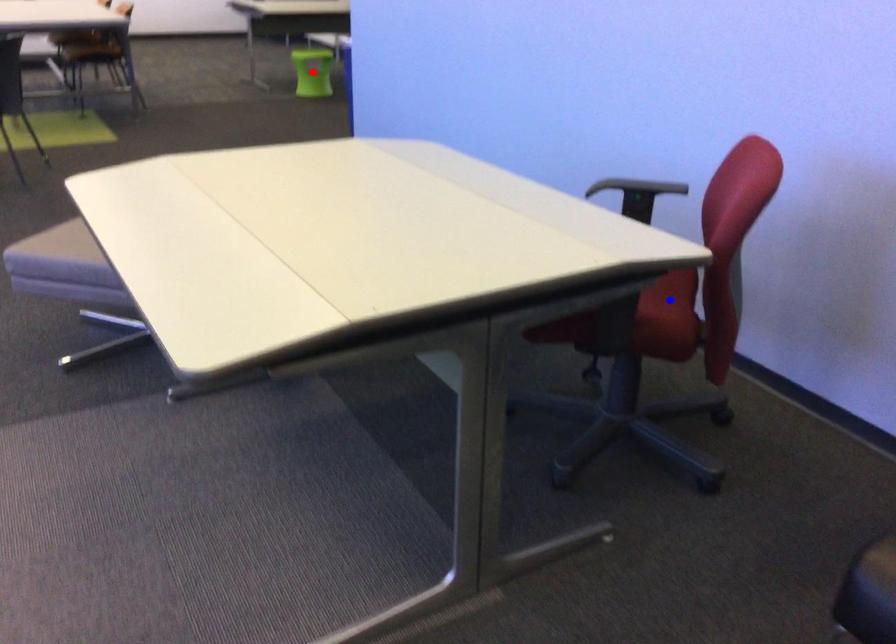
Question: In the image, two points are highlighted. Which point is nearer to the camera? Reply with the corresponding letter.

Choices:
 (A) blue point
 (B) red point

Answer: (A)